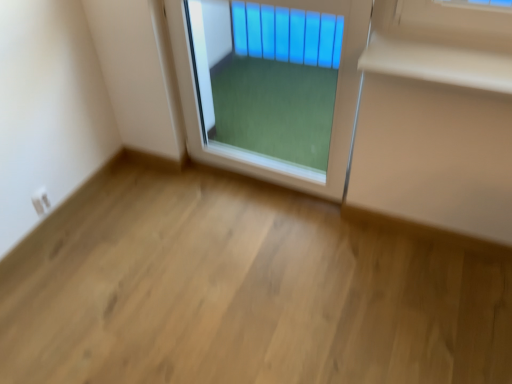
What is the approximate width of transparent glass window at center?

transparent glass window at center is 3.49 inches wide.

You are a GUI agent. You are given a task and a screenshot of the screen. Output one action in this format:
    pyautogui.click(x=<x>, y=<y>)
    Task: Click on the transparent glass window at center
    The height and width of the screenshot is (384, 512).
    Given the screenshot: What is the action you would take?
    pyautogui.click(x=271, y=85)

Describe the element at coordinates (271, 85) in the screenshot. I see `transparent glass window at center` at that location.

In order to click on transparent glass window at center in this screenshot , I will do `click(271, 85)`.